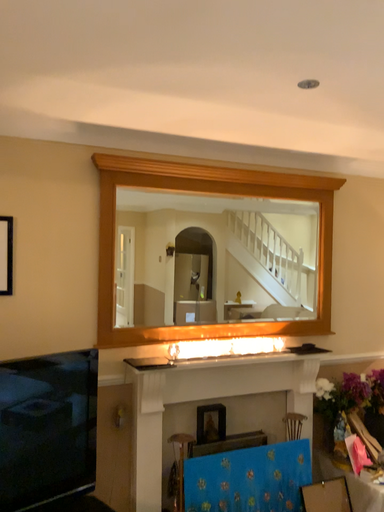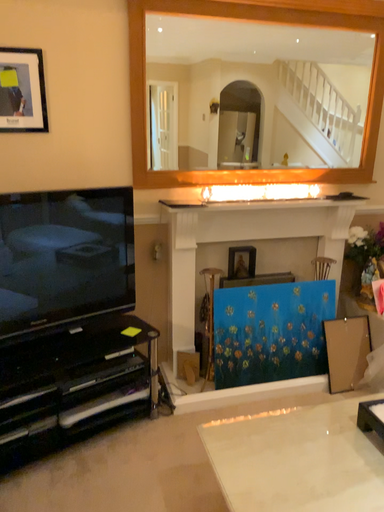
Question: How did the camera likely rotate when shooting the video?

Choices:
 (A) rotated right
 (B) rotated left

Answer: (B)